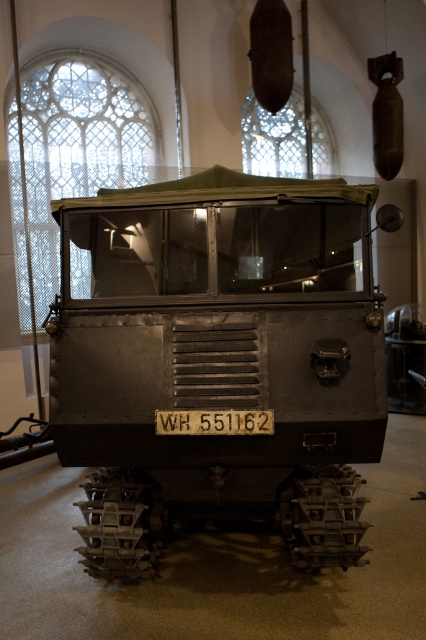
Question: Among these objects, which one is farthest from the camera?

Choices:
 (A) matte gray train car at center
 (B) black metal license plate at center

Answer: (B)

Question: Where is matte gray train car at center located in relation to black metal license plate at center in the image?

Choices:
 (A) left
 (B) right

Answer: (A)

Question: Can you confirm if matte gray train car at center is positioned above black metal license plate at center?

Choices:
 (A) no
 (B) yes

Answer: (B)

Question: Which object is closer to the camera taking this photo?

Choices:
 (A) black metal license plate at center
 (B) matte gray train car at center

Answer: (B)

Question: Is matte gray train car at center wider than black metal license plate at center?

Choices:
 (A) yes
 (B) no

Answer: (A)